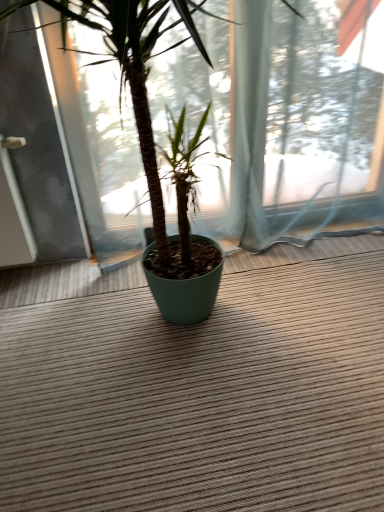
At what (x,y) coordinates should I click in order to perform the action: click on vacant space underneath green textured pot at center (from a real-world perspective). Please return your answer as a coordinate pair (x, y). The width and height of the screenshot is (384, 512). Looking at the image, I should click on (153, 328).